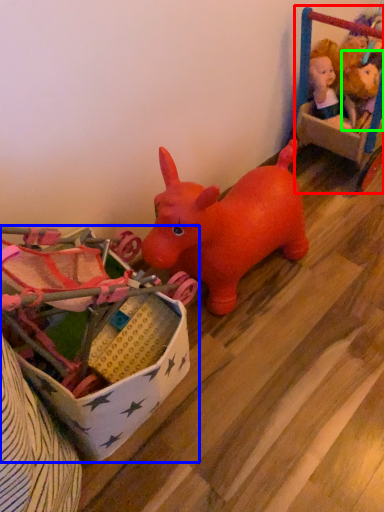
Question: Estimate the real-world distances between objects in this image. Which object is closer to toy (highlighted by a red box), toy (highlighted by a blue box) or toy (highlighted by a green box)?

Choices:
 (A) toy
 (B) toy

Answer: (B)